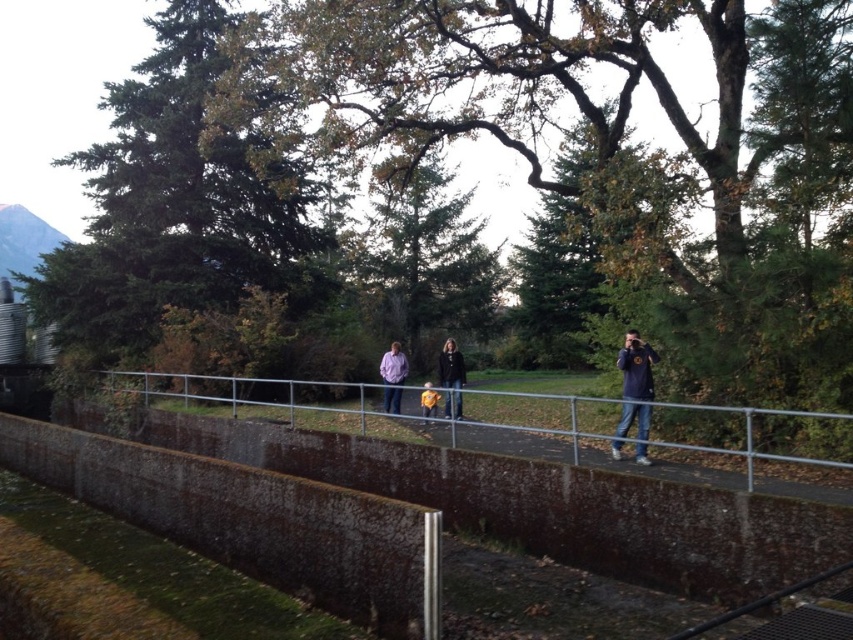
Which is more to the right, pink shirt at center or yellow fabric at center?

yellow fabric at center is more to the right.

Is point (399, 349) positioned in front of point (421, 392)?

That is True.

The image size is (853, 640). Find the location of `pink shirt at center`. pink shirt at center is located at coordinates (393, 376).

You are a GUI agent. You are given a task and a screenshot of the screen. Output one action in this format:
    pyautogui.click(x=<x>, y=<y>)
    Task: Click on the metal/rusty fence at center
    
    Given the screenshot: What is the action you would take?
    pyautogui.click(x=364, y=417)

The height and width of the screenshot is (640, 853). I want to click on metal/rusty fence at center, so click(x=364, y=417).

Which is behind, point (451, 394) or point (384, 365)?

The point (384, 365) is behind.

Between black leather jacket at center and pink shirt at center, which one has less height?

Standing shorter between the two is pink shirt at center.

This screenshot has height=640, width=853. I want to click on black leather jacket at center, so click(x=451, y=378).